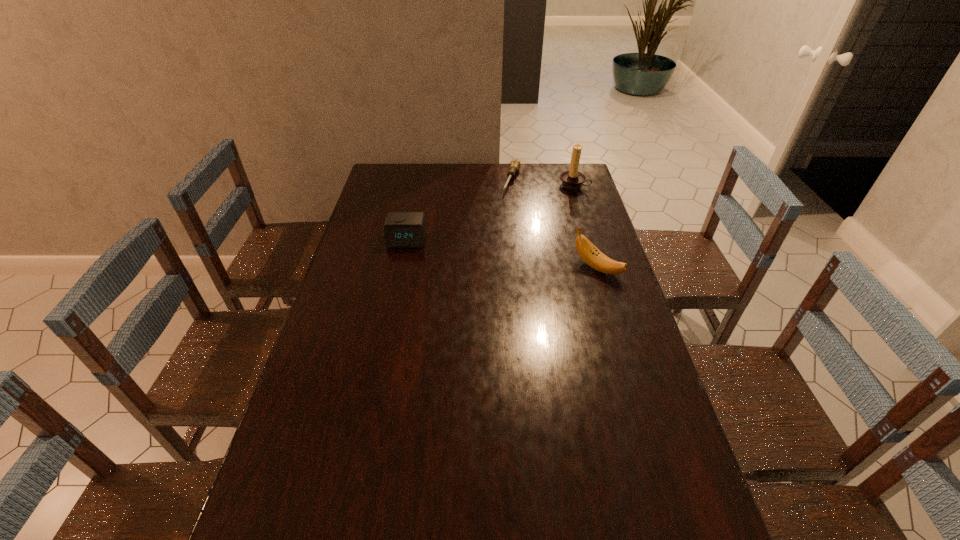
The width and height of the screenshot is (960, 540). What are the coordinates of `object that is at the far right corner` in the screenshot? It's located at [x=573, y=179].

At what (x,y) coordinates should I click in order to perform the action: click on vacant space at the far edge of the desktop. Please return your answer as a coordinate pair (x, y). Looking at the image, I should click on (531, 179).

I want to click on free space at the near edge of the desktop, so click(x=618, y=504).

Where is `vacant space at the left edge`? The height and width of the screenshot is (540, 960). vacant space at the left edge is located at coordinates (376, 301).

You are a GUI agent. You are given a task and a screenshot of the screen. Output one action in this format:
    pyautogui.click(x=<x>, y=<y>)
    Task: Click on the free space at the right edge
    The image size is (960, 540).
    Given the screenshot: What is the action you would take?
    [588, 269]

The width and height of the screenshot is (960, 540). I want to click on vacant area that lies between the third object from right to left and the leftmost object, so point(459,210).

Where is `unoccupied position between the third farthest object and the screwdriver`? unoccupied position between the third farthest object and the screwdriver is located at coordinates (459, 210).

Identify the location of free space that is in between the banana and the tallest object. (586, 226).

Where is `unoccupied area between the third shortest object and the alarm clock`? unoccupied area between the third shortest object and the alarm clock is located at coordinates (502, 254).

Identify the location of blank region between the candle holder and the shortest object. (542, 182).